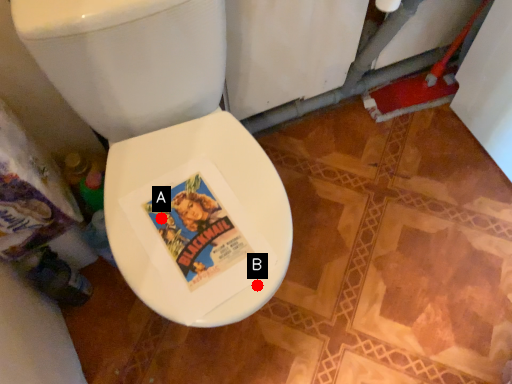
Question: Two points are circled on the image, labeled by A and B beside each circle. Which of the following is the closest to the observer?

Choices:
 (A) A is closer
 (B) B is closer

Answer: (B)